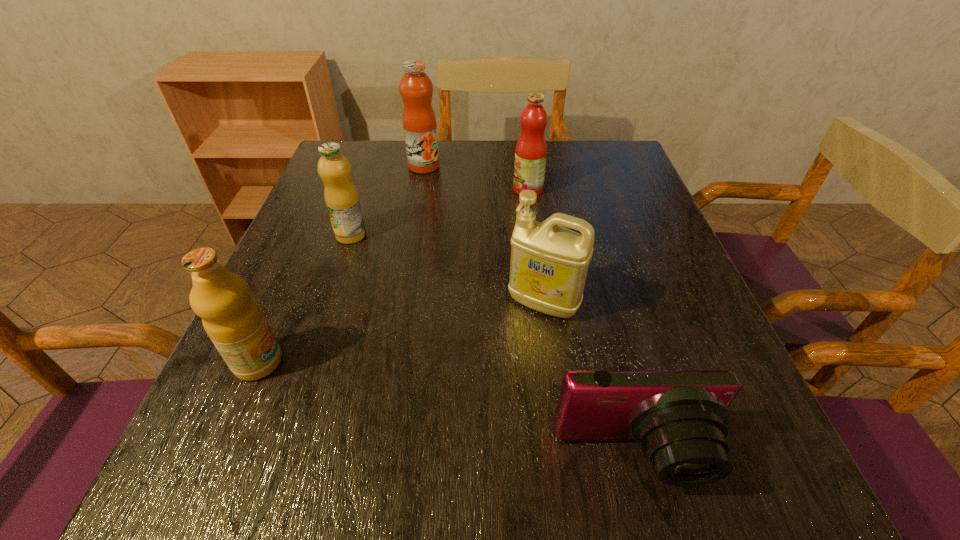
Identify the location of blank region between the second nearest fruit juice and the camera. Image resolution: width=960 pixels, height=540 pixels. (492, 346).

Where is `free area in between the fifth farthest object and the fifth object from right to left`? The image size is (960, 540). free area in between the fifth farthest object and the fifth object from right to left is located at coordinates (304, 299).

The width and height of the screenshot is (960, 540). In order to click on vacant space that's between the nearest object and the rightmost fruit juice in this screenshot , I will do `click(581, 323)`.

Locate an element on the screen. The width and height of the screenshot is (960, 540). vacant area that lies between the third nearest fruit juice and the fourth object from right to left is located at coordinates (476, 178).

Point out which object is positioned as the nearest to the nearest object. Please provide its 2D coordinates. Your answer should be formatted as a tuple, i.e. [(x, y)], where the tuple contains the x and y coordinates of a point satisfying the conditions above.

[(549, 263)]

Identify which object is the third nearest to the fifth nearest object. Please provide its 2D coordinates. Your answer should be formatted as a tuple, i.e. [(x, y)], where the tuple contains the x and y coordinates of a point satisfying the conditions above.

[(341, 197)]

Point out which fruit juice is positioned as the nearest to the third fruit juice from left to right. Please provide its 2D coordinates. Your answer should be formatted as a tuple, i.e. [(x, y)], where the tuple contains the x and y coordinates of a point satisfying the conditions above.

[(531, 149)]

Identify the location of the closest fruit juice to the fourth farthest object. The image size is (960, 540). (531, 149).

Where is `free space that satisfies the following two spatial constraints: 1. on the front label of the second farthest fruit juice; 2. on the front label of the second object from left to right`? The image size is (960, 540). free space that satisfies the following two spatial constraints: 1. on the front label of the second farthest fruit juice; 2. on the front label of the second object from left to right is located at coordinates (535, 235).

Find the location of a particular element. free point that satisfies the following two spatial constraints: 1. on the front label of the farthest object; 2. on the front label of the nearest fruit juice is located at coordinates (389, 362).